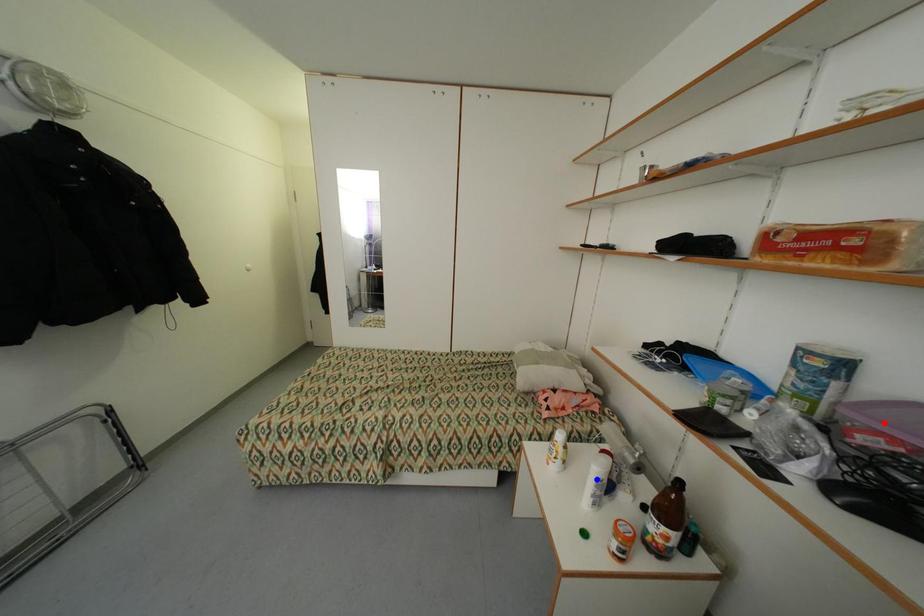
Question: In the image, two points are highlighted. Which point is nearer to the camera? Reply with the corresponding letter.

Choices:
 (A) blue point
 (B) red point

Answer: (B)